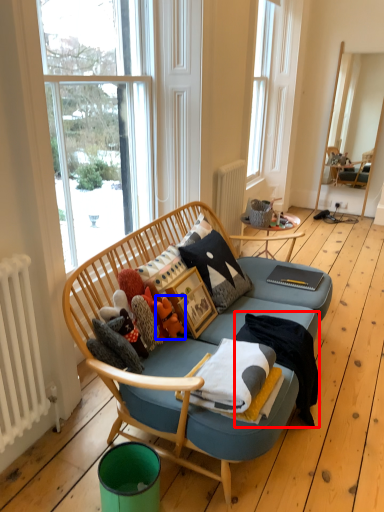
Question: Which object appears farthest to the camera in this image, blanket (highlighted by a red box) or toy (highlighted by a blue box)?

Choices:
 (A) blanket
 (B) toy

Answer: (B)